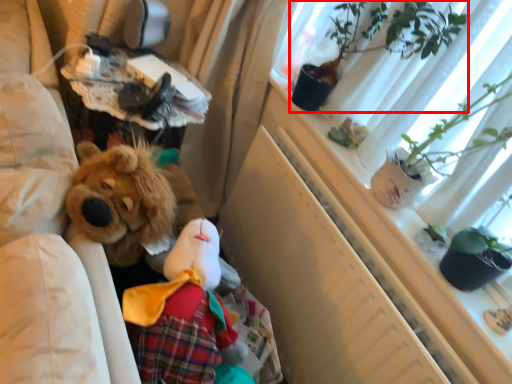
Question: From the image, what is the correct spatial relationship of houseplant (annotated by the red box) in relation to window screen?

Choices:
 (A) right
 (B) left

Answer: (B)